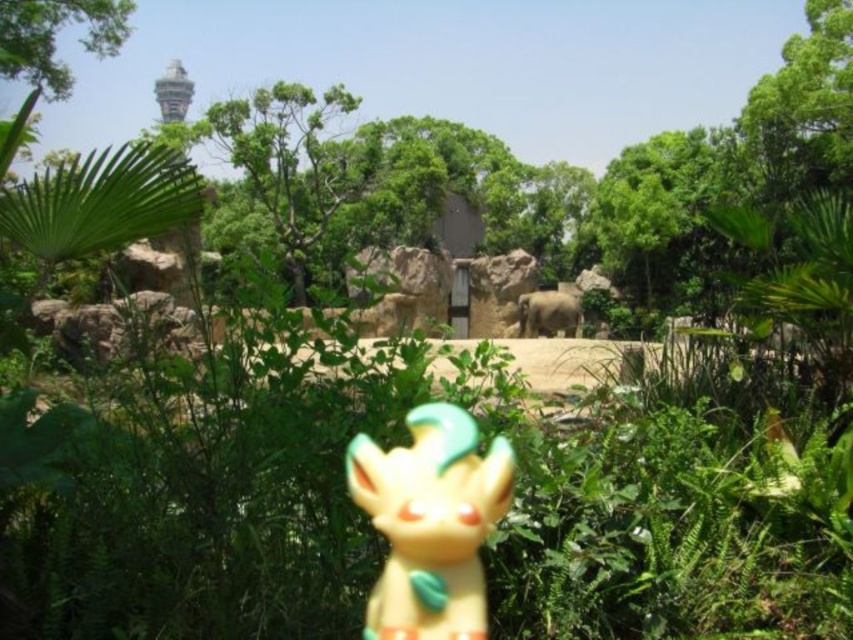
Question: Does green leafy tree at upper left appear on the left side of gray matte elephant at center?

Choices:
 (A) no
 (B) yes

Answer: (B)

Question: Can you confirm if yellow matte figurine at center is positioned to the right of gray matte elephant at center?

Choices:
 (A) no
 (B) yes

Answer: (A)

Question: Which point is closer to the camera?

Choices:
 (A) green leafy tree at upper left
 (B) gray matte elephant at center
 (C) yellow matte figurine at center

Answer: (C)

Question: Which point is farther from the camera taking this photo?

Choices:
 (A) (421, 580)
 (B) (30, 76)
 (C) (577, 304)

Answer: (C)

Question: From the image, what is the correct spatial relationship of yellow matte figurine at center in relation to gray matte elephant at center?

Choices:
 (A) below
 (B) above

Answer: (A)

Question: Among these points, which one is nearest to the camera?

Choices:
 (A) (485, 595)
 (B) (105, 49)
 (C) (564, 316)

Answer: (A)